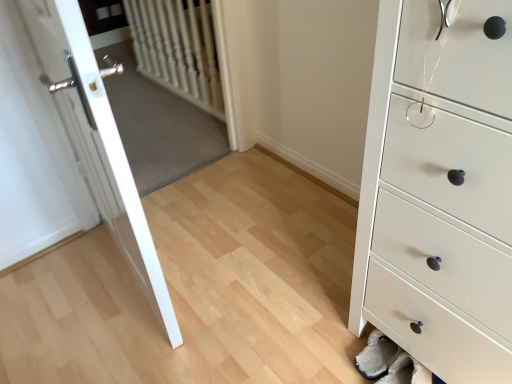
The height and width of the screenshot is (384, 512). Describe the element at coordinates (439, 190) in the screenshot. I see `white matte chest of drawers at lower right` at that location.

The image size is (512, 384). What are the coordinates of `white glossy door at left` in the screenshot? It's located at (98, 142).

The image size is (512, 384). I want to click on radiator lying on the left of white matte chest of drawers at lower right, so tap(178, 49).

Is white matte chest of drawers at lower right outside of white textured radiator at upper left?

Indeed, white matte chest of drawers at lower right is completely outside white textured radiator at upper left.

From a real-world perspective, which is physically below, white matte chest of drawers at lower right or white textured radiator at upper left?

white textured radiator at upper left, from a real-world perspective.

How far apart are white matte chest of drawers at lower right and white textured radiator at upper left?

They are 1.85 meters apart.

Between white textured radiator at upper left and white matte chest of drawers at lower right, which one has smaller size?

white textured radiator at upper left is smaller.

Measure the distance from white textured radiator at upper left to white matte chest of drawers at lower right.

white textured radiator at upper left is 1.85 meters away from white matte chest of drawers at lower right.

From the image's perspective, who appears lower, white textured radiator at upper left or white matte chest of drawers at lower right?

white matte chest of drawers at lower right.

Who is more distant, white textured radiator at upper left or white matte chest of drawers at lower right?

white textured radiator at upper left is more distant.

Can white matte chest of drawers at lower right be found inside white glossy door at left?

No, white matte chest of drawers at lower right is not a part of white glossy door at left.

How different are the orientations of white glossy door at left and white matte chest of drawers at lower right in degrees?

174 degrees separate the facing orientations of white glossy door at left and white matte chest of drawers at lower right.

From the picture: From a real-world perspective, does white glossy door at left stand above white matte chest of drawers at lower right?

Indeed, from a real-world perspective, white glossy door at left stands above white matte chest of drawers at lower right.

Does white glossy door at left have a larger size compared to white matte chest of drawers at lower right?

No, white glossy door at left is not bigger than white matte chest of drawers at lower right.

How much distance is there between white matte chest of drawers at lower right and white glossy door at left?

white matte chest of drawers at lower right and white glossy door at left are 71.61 centimeters apart from each other.

Considering their positions, is white matte chest of drawers at lower right located in front of or behind white glossy door at left?

Visually, white matte chest of drawers at lower right is located in front of white glossy door at left.

Considering the positions of point (472, 258) and point (39, 36), is point (472, 258) closer or farther from the camera than point (39, 36)?

Point (472, 258).

Which of these two, white matte chest of drawers at lower right or white glossy door at left, is thinner?

With smaller width is white glossy door at left.

Is white textured radiator at upper left in contact with white glossy door at left?

No, white textured radiator at upper left is not next to white glossy door at left.

How much distance is there between white textured radiator at upper left and white glossy door at left?

A distance of 1.28 meters exists between white textured radiator at upper left and white glossy door at left.

From the image's perspective, would you say white textured radiator at upper left is positioned over white glossy door at left?

Yes, from the image's perspective, white textured radiator at upper left is over white glossy door at left.

Does white textured radiator at upper left have a larger size compared to white glossy door at left?

Incorrect, white textured radiator at upper left is not larger than white glossy door at left.

Are white glossy door at left and white textured radiator at upper left located far from each other?

white glossy door at left is far away from white textured radiator at upper left.

Which of these two, white glossy door at left or white textured radiator at upper left, is bigger?

Bigger between the two is white glossy door at left.

Can you confirm if white glossy door at left is positioned to the left of white textured radiator at upper left?

Yes.

You are a GUI agent. You are given a task and a screenshot of the screen. Output one action in this format:
    pyautogui.click(x=<x>, y=<y>)
    Task: Click on the chest of drawers that is below the white textured radiator at upper left (from the image's perspective)
    
    Given the screenshot: What is the action you would take?
    439,190

Where is `the chest of drawers above the white textured radiator at upper left (from a real-world perspective)`? the chest of drawers above the white textured radiator at upper left (from a real-world perspective) is located at coordinates (439, 190).

Which object lies nearer to the anchor point white glossy door at left, white matte chest of drawers at lower right or white textured radiator at upper left?

The object closer to white glossy door at left is white matte chest of drawers at lower right.

From the image, which object appears to be nearer to white matte chest of drawers at lower right, white glossy door at left or white textured radiator at upper left?

white glossy door at left lies closer to white matte chest of drawers at lower right than the other object.

When comparing their distances from white textured radiator at upper left, does white matte chest of drawers at lower right or white glossy door at left seem closer?

The object closer to white textured radiator at upper left is white glossy door at left.

When comparing their distances from white glossy door at left, does white textured radiator at upper left or white matte chest of drawers at lower right seem further?

white textured radiator at upper left is further to white glossy door at left.

Looking at the image, which one is located closer to white textured radiator at upper left, white glossy door at left or white matte chest of drawers at lower right?

white glossy door at left is positioned closer to the anchor white textured radiator at upper left.

Estimate the real-world distances between objects in this image. Which object is closer to white matte chest of drawers at lower right, white textured radiator at upper left or white glossy door at left?

Based on the image, white glossy door at left appears to be nearer to white matte chest of drawers at lower right.

You are a GUI agent. You are given a task and a screenshot of the screen. Output one action in this format:
    pyautogui.click(x=<x>, y=<y>)
    Task: Click on the door located between white matte chest of drawers at lower right and white textured radiator at upper left in the depth direction
    This screenshot has width=512, height=384.
    Given the screenshot: What is the action you would take?
    pyautogui.click(x=98, y=142)